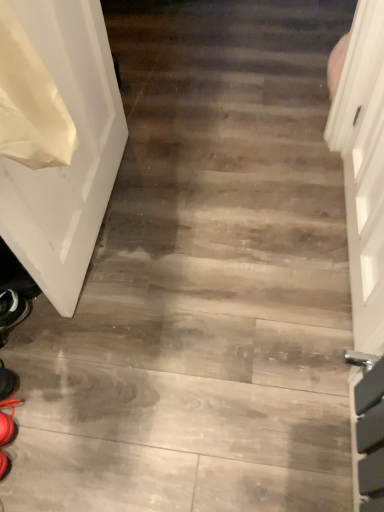
Question: Considering the relative sizes of white glossy door at left and shiny black shoe at lower left in the image provided, is white glossy door at left bigger than shiny black shoe at lower left?

Choices:
 (A) no
 (B) yes

Answer: (B)

Question: From a real-world perspective, is white glossy door at left over shiny black shoe at lower left?

Choices:
 (A) no
 (B) yes

Answer: (B)

Question: Is white glossy door at left thinner than shiny black shoe at lower left?

Choices:
 (A) no
 (B) yes

Answer: (B)

Question: Is white glossy door at left next to shiny black shoe at lower left and touching it?

Choices:
 (A) no
 (B) yes

Answer: (A)

Question: Considering the relative sizes of white glossy door at left and shiny black shoe at lower left in the image provided, is white glossy door at left wider than shiny black shoe at lower left?

Choices:
 (A) yes
 (B) no

Answer: (B)

Question: Is shiny black shoe at lower left at the back of white glossy door at left?

Choices:
 (A) yes
 (B) no

Answer: (B)

Question: Does shiny black shoe at lower left appear on the right side of white glossy door at left?

Choices:
 (A) no
 (B) yes

Answer: (A)

Question: Considering the relative sizes of shiny black shoe at lower left and white glossy door at left in the image provided, is shiny black shoe at lower left shorter than white glossy door at left?

Choices:
 (A) yes
 (B) no

Answer: (A)

Question: Can you confirm if shiny black shoe at lower left is smaller than white glossy door at left?

Choices:
 (A) no
 (B) yes

Answer: (B)

Question: Can you confirm if shiny black shoe at lower left is thinner than white glossy door at left?

Choices:
 (A) yes
 (B) no

Answer: (B)

Question: Are shiny black shoe at lower left and white glossy door at left beside each other?

Choices:
 (A) no
 (B) yes

Answer: (A)

Question: From a real-world perspective, is shiny black shoe at lower left physically below white glossy door at left?

Choices:
 (A) yes
 (B) no

Answer: (A)

Question: Is shiny black shoe at lower left spatially inside white glossy door at left, or outside of it?

Choices:
 (A) inside
 (B) outside

Answer: (B)